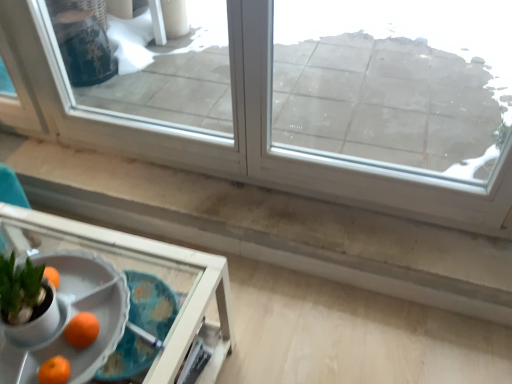
What do you see at coordinates (243, 133) in the screenshot? Image resolution: width=512 pixels, height=384 pixels. I see `transparent glass window at upper center, the 1th window positioned from the left` at bounding box center [243, 133].

This screenshot has width=512, height=384. What are the coordinates of `orange matte at lower left` in the screenshot? It's located at (82, 330).

What do you see at coordinates (82, 330) in the screenshot? The width and height of the screenshot is (512, 384). I see `orange matte at lower left` at bounding box center [82, 330].

This screenshot has width=512, height=384. What do you see at coordinates (117, 294) in the screenshot?
I see `white plastic tray at lower left` at bounding box center [117, 294].

This screenshot has width=512, height=384. I want to click on transparent glass window at upper center, the second window positioned from the left, so click(396, 81).

The height and width of the screenshot is (384, 512). I want to click on transparent glass window at upper center, the second window from the right, so (243, 133).

Looking at the image, does white plastic tray at lower left seem bigger or smaller compared to orange matte at lower left?

Clearly, white plastic tray at lower left is larger in size than orange matte at lower left.

Is white plastic tray at lower left facing towards orange matte at lower left?

No, white plastic tray at lower left is not turned towards orange matte at lower left.

Is point (115, 329) positioned after point (82, 316)?

No, (115, 329) is in front of (82, 316).

Image resolution: width=512 pixels, height=384 pixels. In order to click on table below the orange matte at lower left (from the image's perspective) in this screenshot , I will do `click(117, 294)`.

Which of these two, transparent glass window at upper center, which appears as the first window when viewed from the right, or white plastic tray at lower left, is bigger?

white plastic tray at lower left.

In order to click on table lying on the left of transparent glass window at upper center, which appears as the first window when viewed from the right in this screenshot , I will do `click(117, 294)`.

Is transparent glass window at upper center, which appears as the first window when viewed from the right, at the right side of white plastic tray at lower left?

Correct, you'll find transparent glass window at upper center, which appears as the first window when viewed from the right, to the right of white plastic tray at lower left.

Is point (411, 15) farther from viewer compared to point (210, 265)?

Yes, it is.

I want to click on the 1st window positioned above the orange matte at lower left (from a real-world perspective), so click(243, 133).

Is orange matte at lower left at the right side of transparent glass window at upper center, the 1th window positioned from the left?

No, orange matte at lower left is not to the right of transparent glass window at upper center, the 1th window positioned from the left.

From the picture: Between transparent glass window at upper center, the 1th window positioned from the left, and transparent glass window at upper center, the second window positioned from the left, which one has smaller size?

Smaller between the two is transparent glass window at upper center, the second window positioned from the left.

Considering the sizes of objects transparent glass window at upper center, the second window from the right, and transparent glass window at upper center, the second window positioned from the left, in the image provided, who is wider, transparent glass window at upper center, the second window from the right, or transparent glass window at upper center, the second window positioned from the left,?

Wider between the two is transparent glass window at upper center, the second window positioned from the left.

Does transparent glass window at upper center, the second window from the right, have a greater height compared to transparent glass window at upper center, the second window positioned from the left?

Correct, transparent glass window at upper center, the second window from the right, is much taller as transparent glass window at upper center, the second window positioned from the left.

Is white plastic tray at lower left far from transparent glass window at upper center, the 1th window positioned from the left?

white plastic tray at lower left is near transparent glass window at upper center, the 1th window positioned from the left, not far away.

Considering the relative sizes of white plastic tray at lower left and transparent glass window at upper center, the second window from the right, in the image provided, is white plastic tray at lower left thinner than transparent glass window at upper center, the second window from the right,?

No.

From a real-world perspective, is white plastic tray at lower left beneath transparent glass window at upper center, the 1th window positioned from the left?

Yes, from a real-world perspective, white plastic tray at lower left is beneath transparent glass window at upper center, the 1th window positioned from the left.

Would you say white plastic tray at lower left is outside transparent glass window at upper center, the second window from the right?

Indeed, white plastic tray at lower left is completely outside transparent glass window at upper center, the second window from the right.

Which of these two, white plastic tray at lower left or transparent glass window at upper center, which appears as the first window when viewed from the right, is thinner?

A: With smaller width is transparent glass window at upper center, which appears as the first window when viewed from the right.

Is the depth of white plastic tray at lower left greater than that of transparent glass window at upper center, the second window positioned from the left?

No, white plastic tray at lower left is closer to the viewer.

Would you say white plastic tray at lower left contains transparent glass window at upper center, which appears as the first window when viewed from the right?

No, transparent glass window at upper center, which appears as the first window when viewed from the right, is not surrounded by white plastic tray at lower left.

Is transparent glass window at upper center, which appears as the first window when viewed from the right, thinner than orange matte at lower left?

In fact, transparent glass window at upper center, which appears as the first window when viewed from the right, might be wider than orange matte at lower left.

Which is less distant, [372,25] or [75,341]?

Point [372,25] is positioned farther from the camera compared to point [75,341].

How different are the orientations of transparent glass window at upper center, which appears as the first window when viewed from the right, and orange matte at lower left in degrees?

They differ by 1.04 degrees in their facing directions.

Is transparent glass window at upper center, the second window positioned from the left, turned away from orange matte at lower left?

transparent glass window at upper center, the second window positioned from the left, does not have its back to orange matte at lower left.

You are a GUI agent. You are given a task and a screenshot of the screen. Output one action in this format:
    pyautogui.click(x=<x>, y=<y>)
    Task: Click on the orange behind the white plastic tray at lower left
    
    Given the screenshot: What is the action you would take?
    pyautogui.click(x=82, y=330)

This screenshot has height=384, width=512. I want to click on table located below the transparent glass window at upper center, which appears as the first window when viewed from the right (from the image's perspective), so click(117, 294).

Looking at the image, which one is located closer to transparent glass window at upper center, the second window from the right, orange matte at lower left or white plastic tray at lower left?

white plastic tray at lower left is closer to transparent glass window at upper center, the second window from the right.

Based on the photo, which object lies further to the anchor point transparent glass window at upper center, the second window positioned from the left, orange matte at lower left or transparent glass window at upper center, the 1th window positioned from the left?

orange matte at lower left.

Looking at this image, considering their positions, is white plastic tray at lower left positioned closer to transparent glass window at upper center, the second window positioned from the left, than orange matte at lower left?

Among the two, white plastic tray at lower left is located nearer to transparent glass window at upper center, the second window positioned from the left.

Based on their spatial positions, is white plastic tray at lower left or orange matte at lower left closer to transparent glass window at upper center, the second window from the right?

Among the two, white plastic tray at lower left is located nearer to transparent glass window at upper center, the second window from the right.

From the image, which object appears to be nearer to orange matte at lower left, transparent glass window at upper center, the second window positioned from the left, or white plastic tray at lower left?

white plastic tray at lower left.

Estimate the real-world distances between objects in this image. Which object is further from white plastic tray at lower left, transparent glass window at upper center, the 1th window positioned from the left, or transparent glass window at upper center, the second window positioned from the left?

The object further to white plastic tray at lower left is transparent glass window at upper center, the second window positioned from the left.

When comparing their distances from white plastic tray at lower left, does transparent glass window at upper center, the second window positioned from the left, or transparent glass window at upper center, the second window from the right, seem further?

transparent glass window at upper center, the second window positioned from the left, is positioned further to the anchor white plastic tray at lower left.

Considering their positions, is transparent glass window at upper center, the second window from the right, positioned further to white plastic tray at lower left than orange matte at lower left?

transparent glass window at upper center, the second window from the right, is positioned further to the anchor white plastic tray at lower left.

Locate an element on the screen. The width and height of the screenshot is (512, 384). orange between transparent glass window at upper center, the second window from the right, and white plastic tray at lower left from top to bottom is located at coordinates (82, 330).

This screenshot has height=384, width=512. Identify the location of orange between white plastic tray at lower left and transparent glass window at upper center, which appears as the first window when viewed from the right, in the horizontal direction. (82, 330).

Image resolution: width=512 pixels, height=384 pixels. I want to click on window between white plastic tray at lower left and transparent glass window at upper center, which appears as the first window when viewed from the right, so click(243, 133).

At what (x,y) coordinates should I click in order to perform the action: click on window located between orange matte at lower left and transparent glass window at upper center, which appears as the first window when viewed from the right, in the left-right direction. Please return your answer as a coordinate pair (x, y). Looking at the image, I should click on (243, 133).